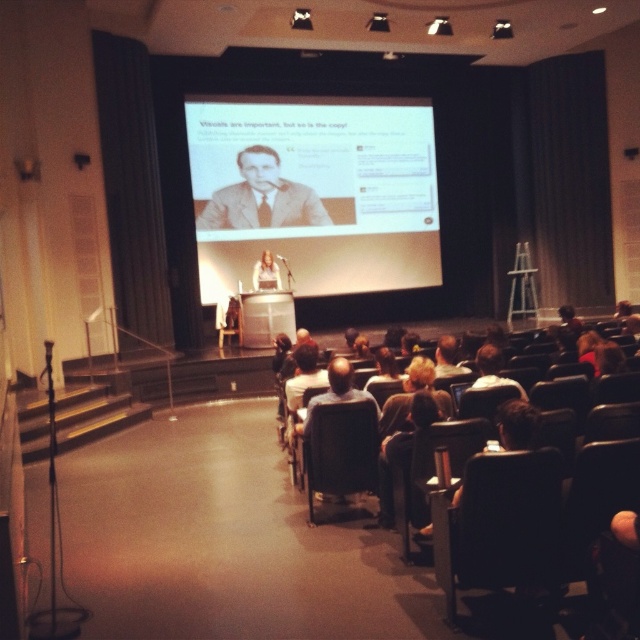
Question: Which object is farther from the camera taking this photo?

Choices:
 (A) matte beige suit at center
 (B) matte projector screen at center

Answer: (A)

Question: Can you confirm if matte projector screen at center is positioned below matte beige suit at center?

Choices:
 (A) no
 (B) yes

Answer: (B)

Question: Can you confirm if black leather chair at center is smaller than matte beige suit at center?

Choices:
 (A) yes
 (B) no

Answer: (A)

Question: Is black leather chair at center to the right of matte plastic woman at center from the viewer's perspective?

Choices:
 (A) no
 (B) yes

Answer: (B)

Question: Based on their relative distances, which object is farther from the black leather chair at lower right?

Choices:
 (A) matte plastic woman at center
 (B) matte projector screen at center

Answer: (B)

Question: Which point is farther to the camera?

Choices:
 (A) matte plastic woman at center
 (B) matte black chair at center

Answer: (B)